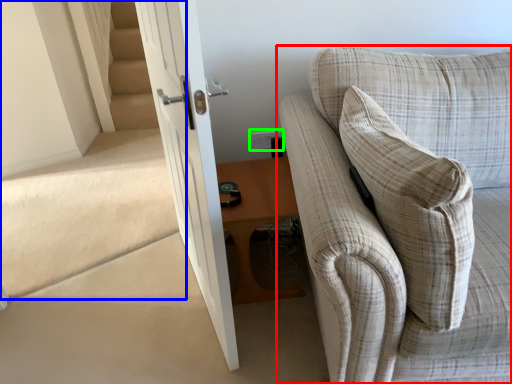
Question: Which object is positioned closest to studio couch (highlighted by a red box)? Select from stairwell (highlighted by a blue box) and electric outlet (highlighted by a green box).

Choices:
 (A) stairwell
 (B) electric outlet

Answer: (B)